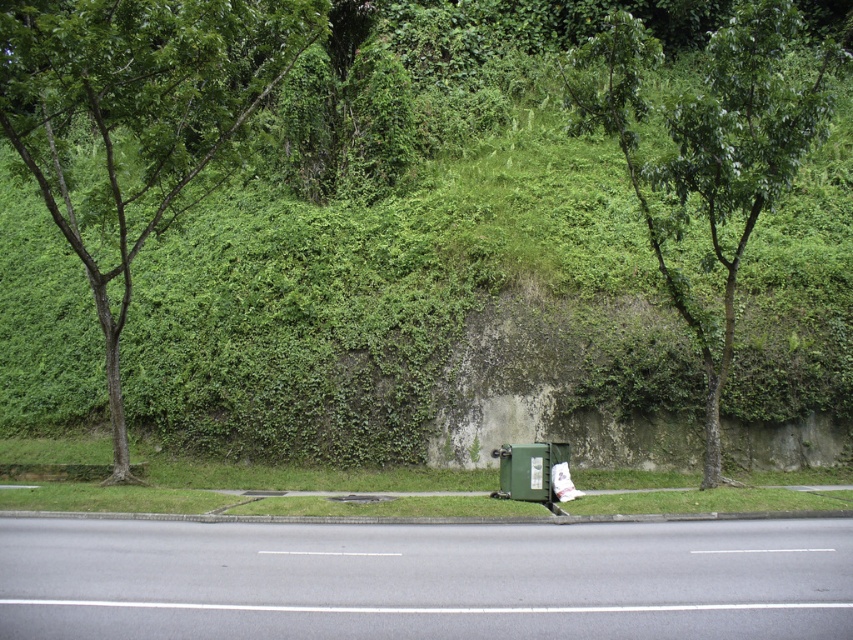
Question: Among these objects, which one is nearest to the camera?

Choices:
 (A) green leafy hillside at center
 (B) green leafy tree at left
 (C) green leafy tree at center

Answer: (B)

Question: Can you confirm if green leafy hillside at center is bigger than green leafy tree at left?

Choices:
 (A) no
 (B) yes

Answer: (B)

Question: Considering the relative positions of green leafy hillside at center and green leafy tree at center in the image provided, where is green leafy hillside at center located with respect to green leafy tree at center?

Choices:
 (A) right
 (B) left

Answer: (B)

Question: Which object is closer to the camera taking this photo?

Choices:
 (A) green leafy tree at center
 (B) green leafy hillside at center
 (C) green leafy tree at left

Answer: (C)

Question: Does green leafy hillside at center appear on the right side of green leafy tree at left?

Choices:
 (A) no
 (B) yes

Answer: (B)

Question: Which of the following is the farthest from the observer?

Choices:
 (A) (115, 60)
 (B) (567, 240)
 (C) (810, 83)

Answer: (C)